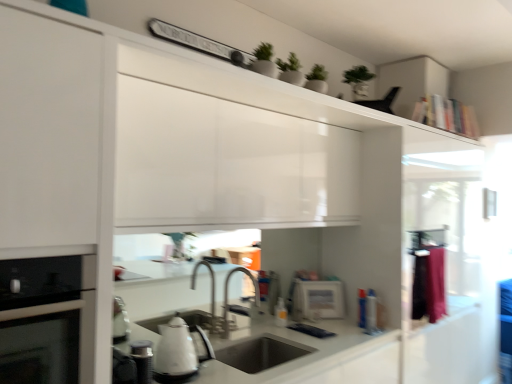
Question: Considering the relative positions of matte stainless steel sink at center and translucent plastic bottle at sink in the image provided, is matte stainless steel sink at center to the left of translucent plastic bottle at sink from the viewer's perspective?

Choices:
 (A) no
 (B) yes

Answer: (B)

Question: Is matte stainless steel sink at center oriented away from translucent plastic bottle at sink?

Choices:
 (A) yes
 (B) no

Answer: (B)

Question: From a real-world perspective, is matte stainless steel sink at center over translucent plastic bottle at sink?

Choices:
 (A) yes
 (B) no

Answer: (B)

Question: Considering the relative sizes of matte stainless steel sink at center and translucent plastic bottle at sink in the image provided, is matte stainless steel sink at center bigger than translucent plastic bottle at sink?

Choices:
 (A) no
 (B) yes

Answer: (B)

Question: From the image's perspective, does matte stainless steel sink at center appear lower than translucent plastic bottle at sink?

Choices:
 (A) yes
 (B) no

Answer: (A)

Question: Is white glossy kettle at lower left, the 2th appliance positioned from the bottom, inside the boundaries of silver metallic faucet at center, or outside?

Choices:
 (A) inside
 (B) outside

Answer: (B)

Question: Is white glossy kettle at lower left, which is the 3th appliance from back to front, in front of or behind silver metallic faucet at center in the image?

Choices:
 (A) behind
 (B) front

Answer: (B)

Question: Is point (148, 352) closer or farther from the camera than point (225, 337)?

Choices:
 (A) farther
 (B) closer

Answer: (B)

Question: Would you say white glossy kettle at lower left, which is the 2th appliance from top to bottom, is to the left or to the right of silver metallic faucet at center in the picture?

Choices:
 (A) right
 (B) left

Answer: (B)

Question: From the image's perspective, is white glossy kettle at lower center above or below silver metallic faucet at center?

Choices:
 (A) below
 (B) above

Answer: (A)

Question: Considering their positions, is white glossy kettle at lower center located in front of or behind silver metallic faucet at center?

Choices:
 (A) front
 (B) behind

Answer: (A)

Question: From a real-world perspective, relative to silver metallic faucet at center, is white glossy kettle at lower center vertically above or below?

Choices:
 (A) below
 (B) above

Answer: (A)

Question: Is white glossy kettle at lower center inside the boundaries of silver metallic faucet at center, or outside?

Choices:
 (A) inside
 (B) outside

Answer: (B)

Question: Looking at the image, does silver metallic faucet at center seem bigger or smaller compared to white glossy microwave at center, the third appliance viewed from the top?

Choices:
 (A) big
 (B) small

Answer: (A)

Question: Choose the correct answer: Is silver metallic faucet at center inside white glossy microwave at center, the 3th appliance positioned from the front, or outside it?

Choices:
 (A) outside
 (B) inside

Answer: (A)